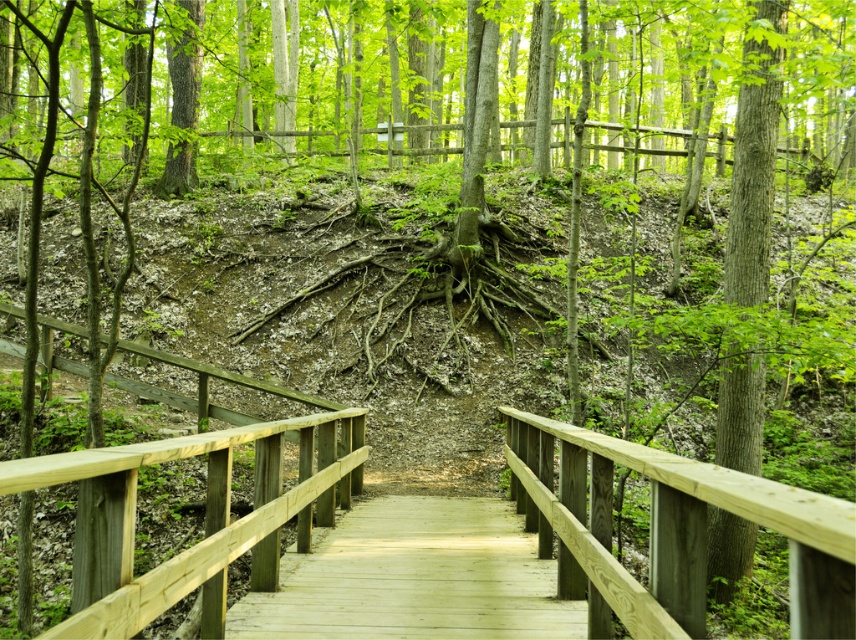
Find the location of a particular element. light brown wooden path at center is located at coordinates (414, 577).

Does point (491, 624) come farther from viewer compared to point (718, 429)?

No.

What are the coordinates of `light brown wooden path at center` in the screenshot? It's located at (414, 577).